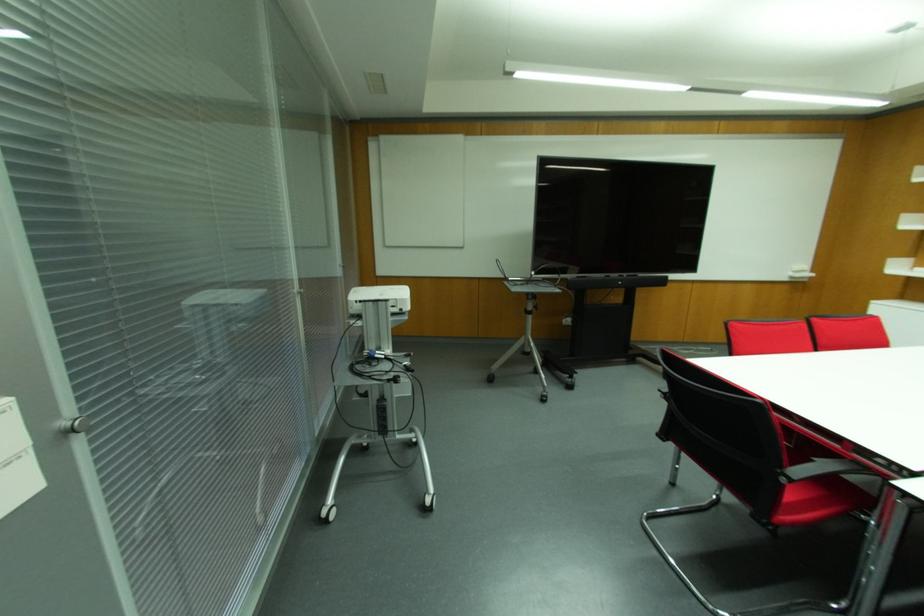
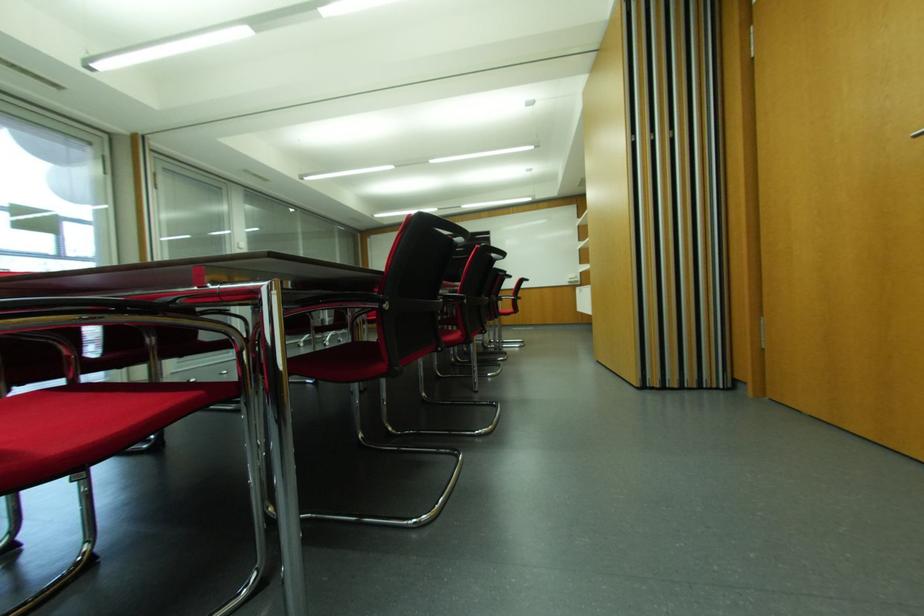
Question: I am providing you with two images of the same scene from different viewpoints. After the viewpoint changes to image2, which objects are now occluded?

Choices:
 (A) red chair sitting surface
 (B) silver door handle
 (C) white projector
 (D) red food bag

Answer: (C)